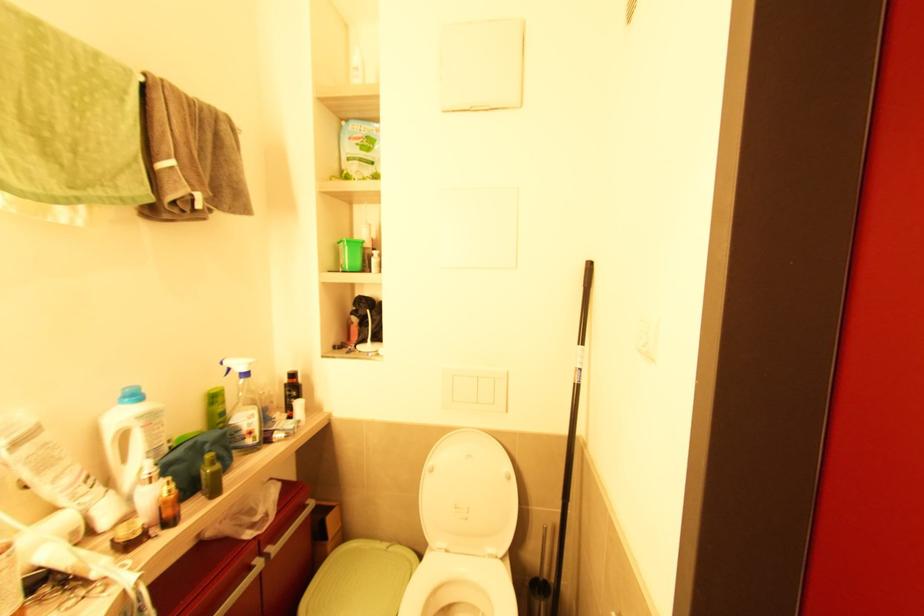
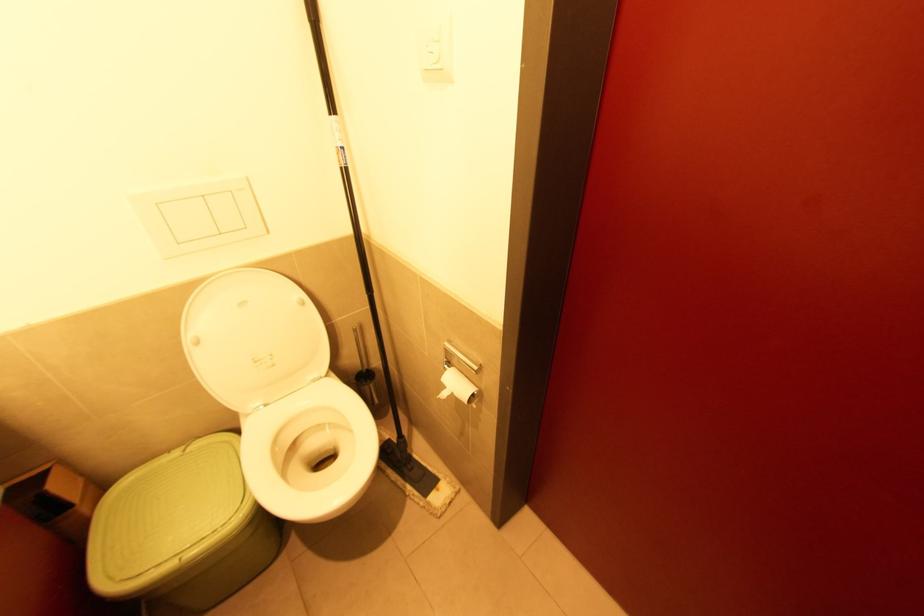
Locate, in the second image, the point that corresponds to (x=479, y=403) in the first image.

(224, 235)